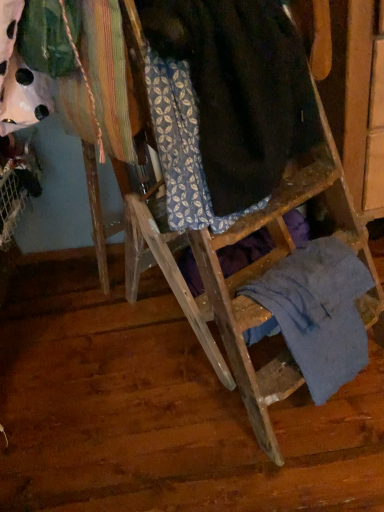
Question: Is blue cotton shirt at lower right located within dark brown wool at center?

Choices:
 (A) no
 (B) yes

Answer: (A)

Question: From a real-world perspective, is dark brown wool at center below blue cotton shirt at lower right?

Choices:
 (A) no
 (B) yes

Answer: (A)

Question: Does dark brown wool at center have a greater width compared to blue cotton shirt at lower right?

Choices:
 (A) no
 (B) yes

Answer: (B)

Question: Does dark brown wool at center appear on the right side of blue cotton shirt at lower right?

Choices:
 (A) yes
 (B) no

Answer: (B)

Question: Considering the relative sizes of dark brown wool at center and blue cotton shirt at lower right in the image provided, is dark brown wool at center smaller than blue cotton shirt at lower right?

Choices:
 (A) yes
 (B) no

Answer: (B)

Question: Is dark brown wool at center outside of blue cotton shirt at lower right?

Choices:
 (A) no
 (B) yes

Answer: (B)

Question: Considering the relative sizes of blue cotton shirt at lower right and dark brown wool at center in the image provided, is blue cotton shirt at lower right thinner than dark brown wool at center?

Choices:
 (A) no
 (B) yes

Answer: (B)

Question: Is blue cotton shirt at lower right positioned with its back to dark brown wool at center?

Choices:
 (A) yes
 (B) no

Answer: (B)

Question: Is dark brown wool at center inside blue cotton shirt at lower right?

Choices:
 (A) yes
 (B) no

Answer: (B)

Question: Could you tell me if blue cotton shirt at lower right is facing dark brown wool at center?

Choices:
 (A) yes
 (B) no

Answer: (B)

Question: From a real-world perspective, is blue cotton shirt at lower right positioned over dark brown wool at center based on gravity?

Choices:
 (A) yes
 (B) no

Answer: (B)

Question: Considering the relative positions of blue cotton shirt at lower right and dark brown wool at center in the image provided, is blue cotton shirt at lower right to the right of dark brown wool at center from the viewer's perspective?

Choices:
 (A) no
 (B) yes

Answer: (B)

Question: Looking at the image, does blue cotton shirt at lower right seem bigger or smaller compared to dark brown wool at center?

Choices:
 (A) big
 (B) small

Answer: (B)